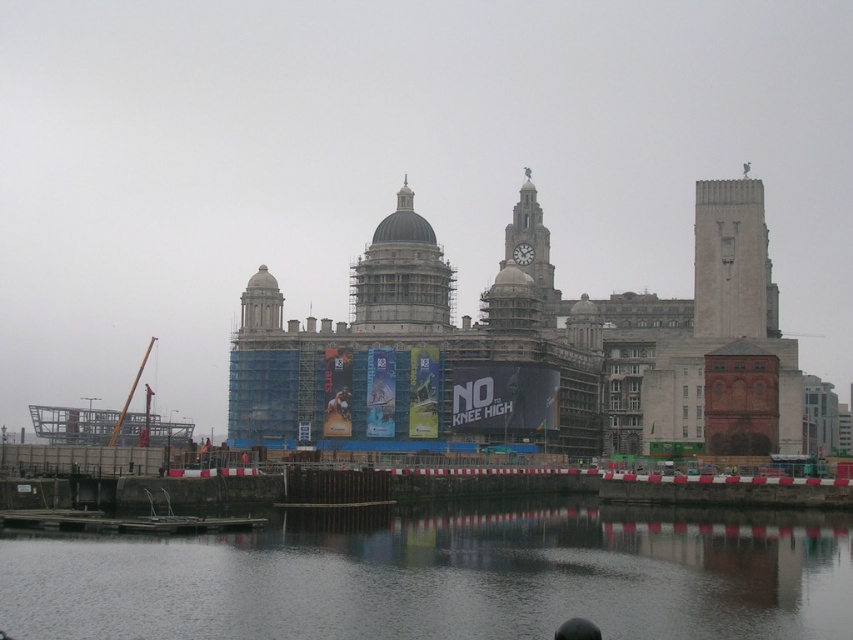
Does smooth dark water at lower center appear on the right side of gray stone dome at center?

Yes, smooth dark water at lower center is to the right of gray stone dome at center.

Can you confirm if smooth dark water at lower center is shorter than gray stone dome at center?

Yes, smooth dark water at lower center is shorter than gray stone dome at center.

Who is more distant from viewer, (641, 541) or (418, 308)?

The point (418, 308) is behind.

You are a GUI agent. You are given a task and a screenshot of the screen. Output one action in this format:
    pyautogui.click(x=<x>, y=<y>)
    Task: Click on the smooth dark water at lower center
    Image resolution: width=853 pixels, height=640 pixels.
    Given the screenshot: What is the action you would take?
    pyautogui.click(x=444, y=577)

Based on the photo, does smooth concrete tower at upper right appear on the right side of gray stone dome at center?

Yes, smooth concrete tower at upper right is to the right of gray stone dome at center.

Can you confirm if smooth concrete tower at upper right is shorter than gray stone dome at center?

Incorrect, smooth concrete tower at upper right's height does not fall short of gray stone dome at center's.

Which is in front, point (746, 291) or point (403, 218)?

Point (403, 218) is more forward.

At what (x,y) coordinates should I click in order to perform the action: click on smooth concrete tower at upper right. Please return your answer as a coordinate pair (x, y). Looking at the image, I should click on (732, 260).

Between smooth dark water at lower center and smooth concrete tower at upper right, which one appears on the right side from the viewer's perspective?

From the viewer's perspective, smooth concrete tower at upper right appears more on the right side.

Which is above, smooth dark water at lower center or smooth concrete tower at upper right?

smooth concrete tower at upper right

Is point (486, 637) closer to viewer compared to point (711, 320)?

Yes.

The image size is (853, 640). I want to click on smooth dark water at lower center, so click(x=444, y=577).